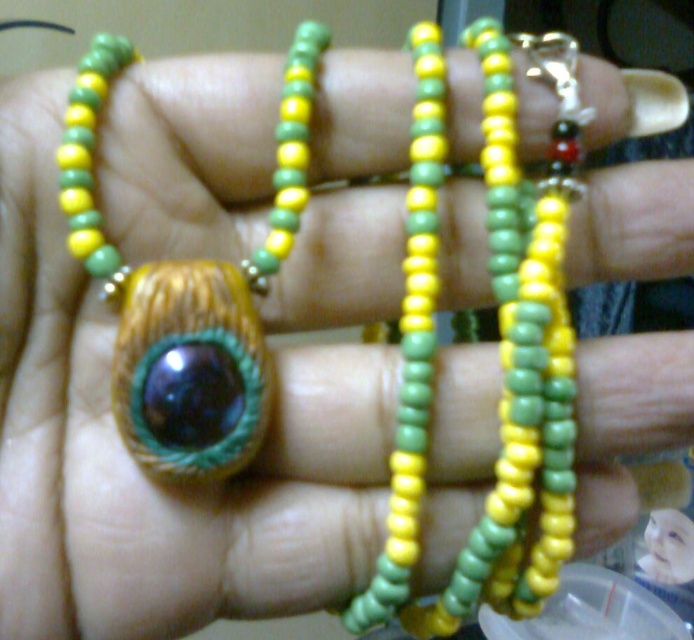
Is the position of matte plastic face at center more distant than that of matte brown eye at center?

No, matte plastic face at center is in front of matte brown eye at center.

Between point (668, 561) and point (682, 525), which one is positioned in front?

Point (668, 561)

You are a GUI agent. You are given a task and a screenshot of the screen. Output one action in this format:
    pyautogui.click(x=<x>, y=<y>)
    Task: Click on the matte plastic face at center
    
    Given the screenshot: What is the action you would take?
    pyautogui.click(x=668, y=547)